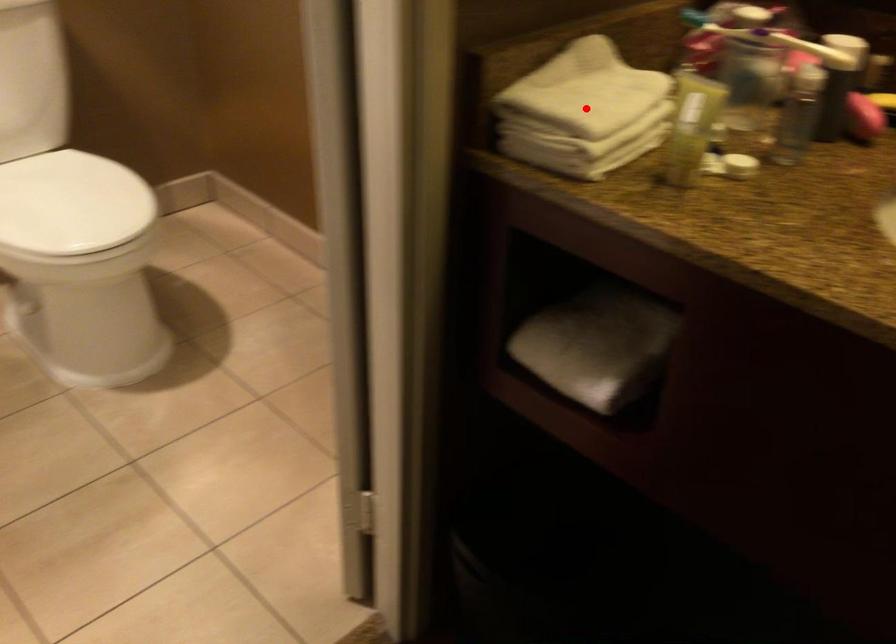
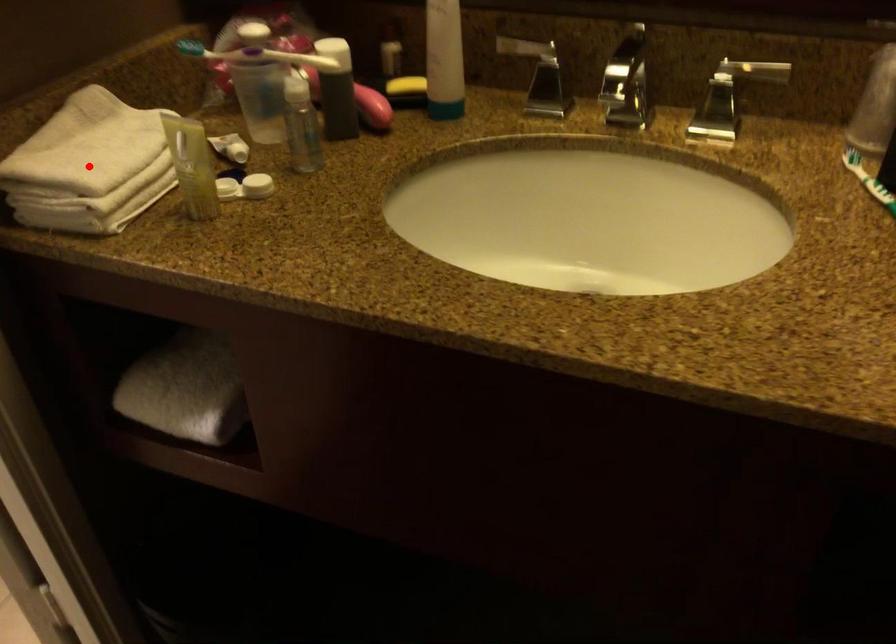
I am providing you with two images of the same scene from different viewpoints. A red point is marked on the first image and another point is marked on the second image. Do the highlighted points in image1 and image2 indicate the same real-world spot?

Yes